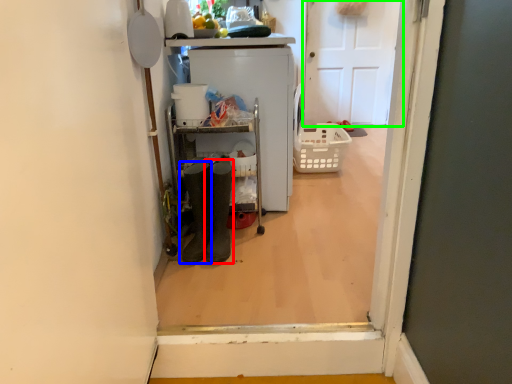
Question: Considering the real-world distances, which object is closest to footwear (highlighted by a red box)? footwear (highlighted by a blue box) or door (highlighted by a green box).

Choices:
 (A) footwear
 (B) door

Answer: (A)